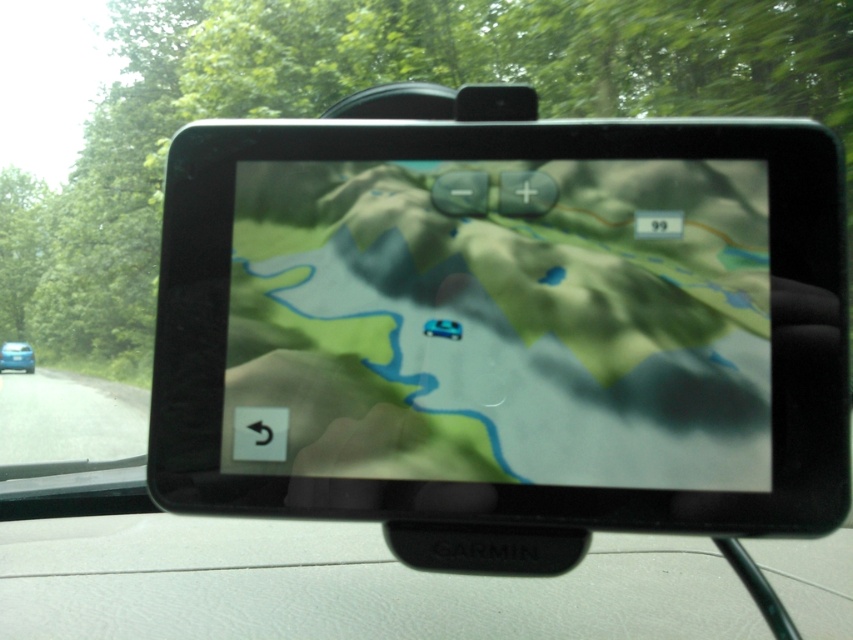
Question: Which of the following is the closest to the observer?

Choices:
 (A) coord(633,400)
 (B) coord(0,360)

Answer: (A)

Question: Does green matte map at center lie behind blue glossy car at center?

Choices:
 (A) no
 (B) yes

Answer: (A)

Question: Among these objects, which one is farthest from the camera?

Choices:
 (A) green matte map at center
 (B) blue glossy car at center

Answer: (B)

Question: Among these objects, which one is farthest from the camera?

Choices:
 (A) blue glossy car at center
 (B) green matte map at center

Answer: (A)

Question: In this image, where is green matte map at center located relative to blue glossy car at center?

Choices:
 (A) left
 (B) right

Answer: (B)

Question: Observing the image, what is the correct spatial positioning of green matte map at center in reference to blue glossy car at center?

Choices:
 (A) left
 (B) right

Answer: (B)